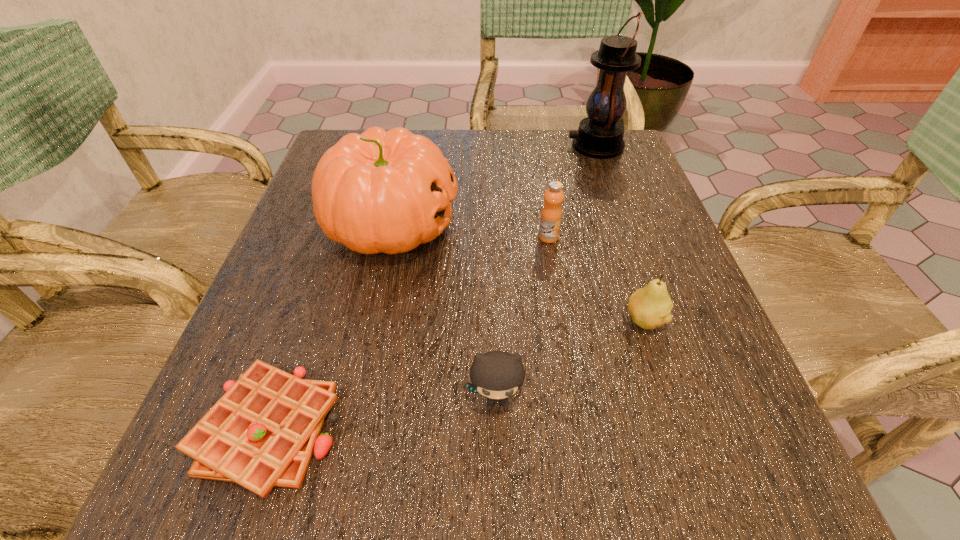
The height and width of the screenshot is (540, 960). In order to click on pear that is at the right edge in this screenshot , I will do `click(650, 307)`.

You are a GUI agent. You are given a task and a screenshot of the screen. Output one action in this format:
    pyautogui.click(x=<x>, y=<y>)
    Task: Click on the object present at the near left corner
    This screenshot has width=960, height=540.
    Given the screenshot: What is the action you would take?
    tap(262, 432)

This screenshot has height=540, width=960. I want to click on object located in the far right corner section of the desktop, so click(600, 135).

The image size is (960, 540). In the image, there is a desktop. In order to click on free region at the far edge in this screenshot , I will do coord(434,131).

In the image, there is a desktop. At what (x,y) coordinates should I click in order to perform the action: click on vacant space at the near edge. Please return your answer as a coordinate pair (x, y). Looking at the image, I should click on (384, 488).

You are a GUI agent. You are given a task and a screenshot of the screen. Output one action in this format:
    pyautogui.click(x=<x>, y=<y>)
    Task: Click on the vacant area at the left edge of the desktop
    This screenshot has width=960, height=540.
    Given the screenshot: What is the action you would take?
    pyautogui.click(x=334, y=329)

The width and height of the screenshot is (960, 540). Find the location of `vacant space at the right edge of the desktop`. vacant space at the right edge of the desktop is located at coordinates (696, 336).

The width and height of the screenshot is (960, 540). I want to click on blank space at the near left corner of the desktop, so click(x=302, y=484).

In the image, there is a desktop. Where is `vacant space at the far right corner`? This screenshot has width=960, height=540. vacant space at the far right corner is located at coordinates click(606, 172).

Where is `vacant space at the near right corner of the desktop`? The width and height of the screenshot is (960, 540). vacant space at the near right corner of the desktop is located at coordinates (795, 498).